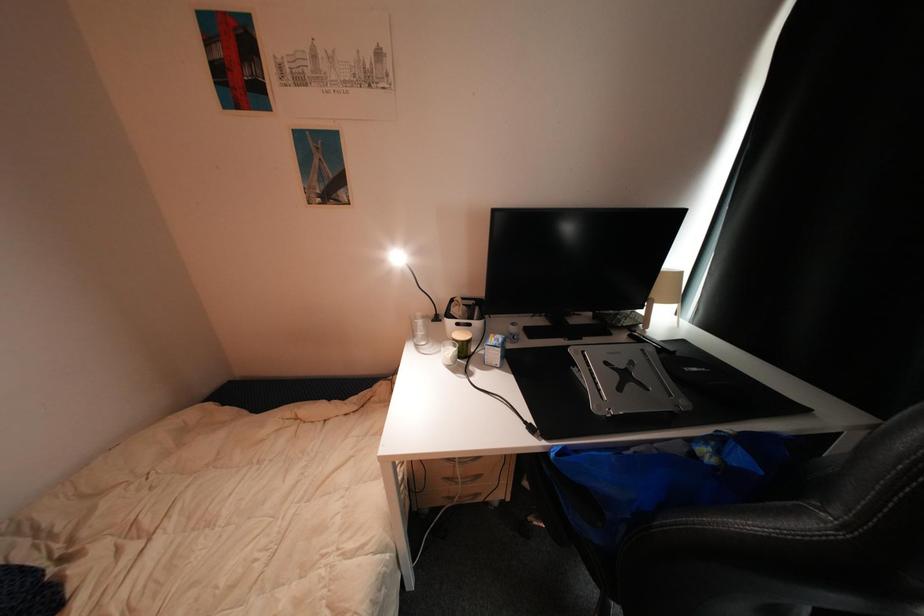
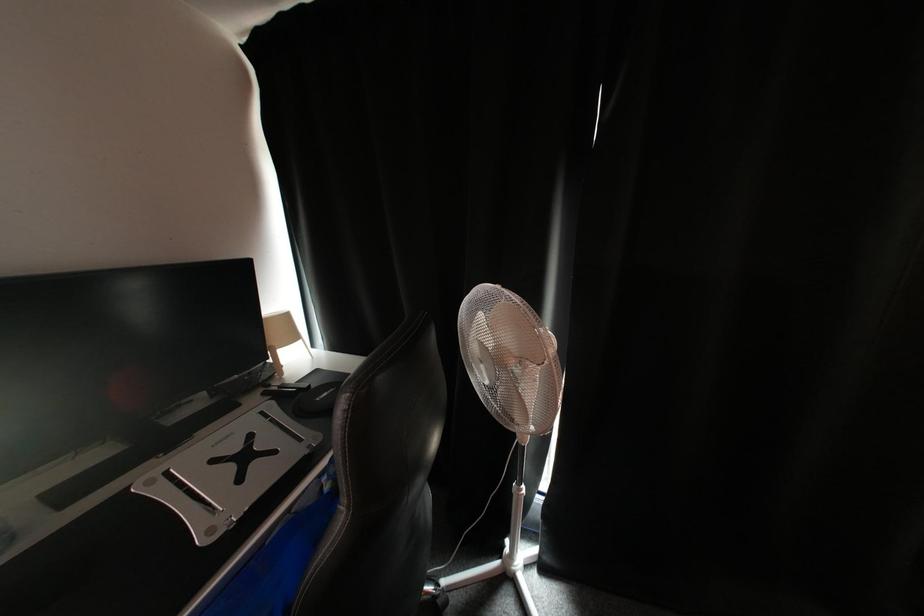
Question: How did the camera likely rotate?

Choices:
 (A) Left
 (B) Right
 (C) Up
 (D) Down

Answer: (B)